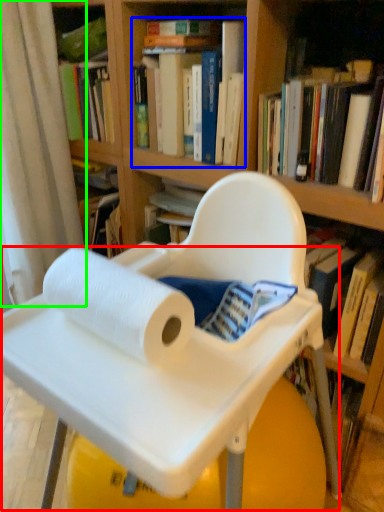
Question: Which object is positioned farthest from table (highlighted by a red box)? Select from book (highlighted by a blue box) and curtain (highlighted by a green box).

Choices:
 (A) book
 (B) curtain

Answer: (B)